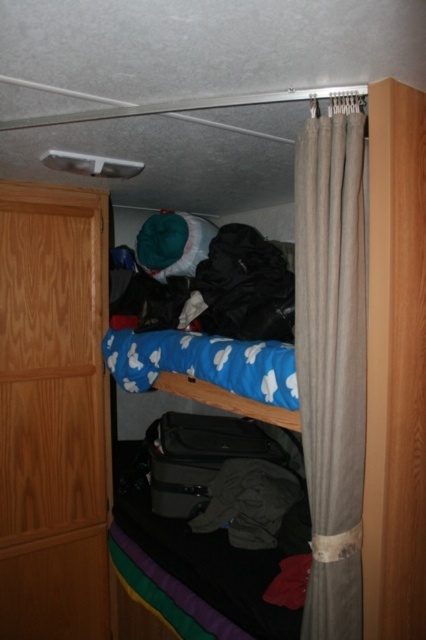
What are the coordinates of `beige fabric curtain at right` in the screenshot? It's located at (331, 364).

Does beige fabric curtain at right have a lesser height compared to black fabric at center?

In fact, beige fabric curtain at right may be taller than black fabric at center.

Is point (348, 268) farther from viewer compared to point (259, 280)?

No, it is not.

Locate an element on the screen. beige fabric curtain at right is located at coordinates (331, 364).

Between black fabric at center and gray cotton shirt at lower center, which one has more height?

Standing taller between the two is black fabric at center.

In the scene shown: Who is lower down, black fabric at center or gray cotton shirt at lower center?

gray cotton shirt at lower center is below.

Which is in front, point (207, 321) or point (232, 499)?

Point (232, 499)

This screenshot has width=426, height=640. Find the location of `black fabric at center`. black fabric at center is located at coordinates (245, 285).

Which is more to the left, beige fabric curtain at right or gray cotton shirt at lower center?

gray cotton shirt at lower center is more to the left.

Who is more distant from viewer, (331, 412) or (221, 515)?

Point (221, 515)

Find the location of a particular element. This screenshot has height=640, width=426. beige fabric curtain at right is located at coordinates (331, 364).